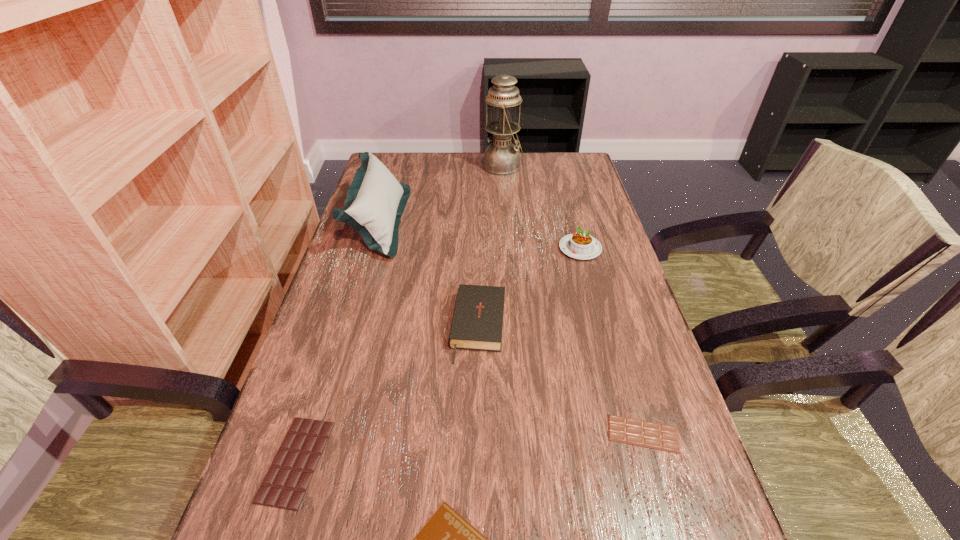
Locate an element on the screen. Image resolution: width=960 pixels, height=540 pixels. the farthest object is located at coordinates 501,157.

Where is `the tallest object`? This screenshot has height=540, width=960. the tallest object is located at coordinates (501, 157).

Where is `the second tallest object`? The height and width of the screenshot is (540, 960). the second tallest object is located at coordinates click(375, 201).

Locate an element on the screen. The image size is (960, 540). the fifth shortest object is located at coordinates (581, 245).

The width and height of the screenshot is (960, 540). I want to click on the fourth farthest object, so click(477, 324).

This screenshot has width=960, height=540. In order to click on the fourth tallest object in this screenshot , I will do `click(477, 324)`.

Image resolution: width=960 pixels, height=540 pixels. In order to click on the leftmost chocolate bar in this screenshot , I will do `click(285, 484)`.

The width and height of the screenshot is (960, 540). Identify the location of the tallest chocolate bar. (285, 484).

Where is `the rightmost chocolate bar`? The width and height of the screenshot is (960, 540). the rightmost chocolate bar is located at coordinates (647, 434).

Where is `the sixth tallest object`? The height and width of the screenshot is (540, 960). the sixth tallest object is located at coordinates (647, 434).